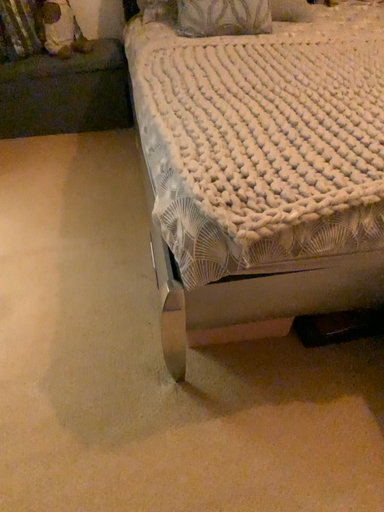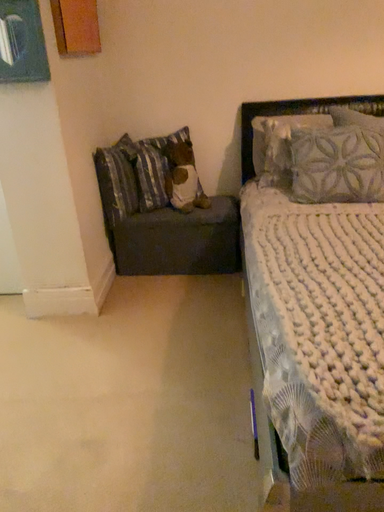
Question: Which way did the camera rotate in the video?

Choices:
 (A) rotated upward
 (B) rotated downward

Answer: (A)